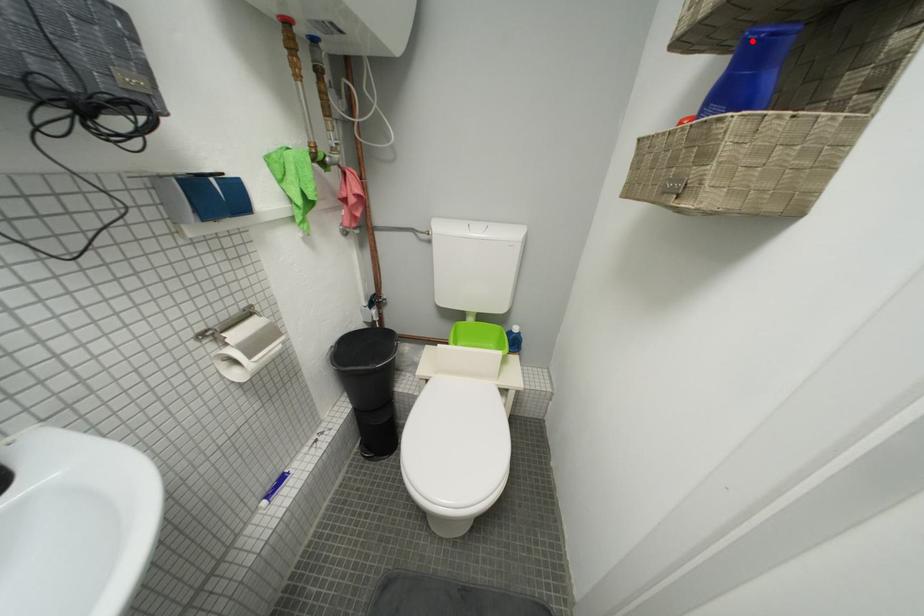
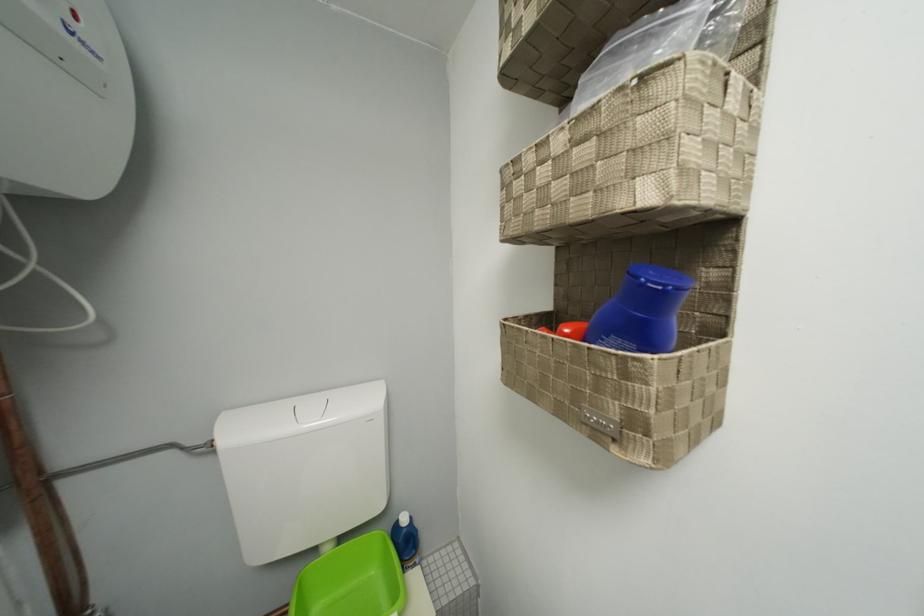
The point at the highlighted location is marked in the first image. Where is the corresponding point in the second image?

(651, 286)